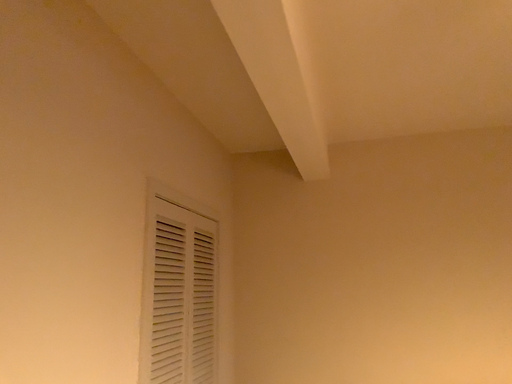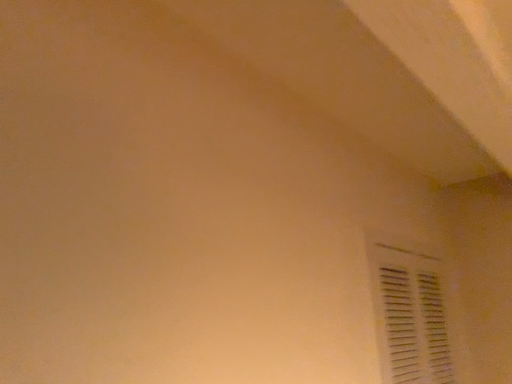
Question: How did the camera likely rotate when shooting the video?

Choices:
 (A) rotated left
 (B) rotated right

Answer: (A)